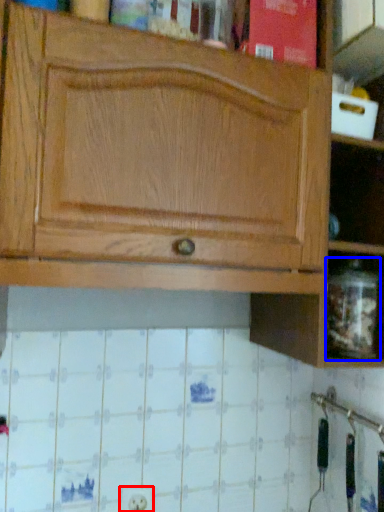
Question: Which of the following is the farthest to the observer, electric outlet (highlighted by a red box) or glass jar (highlighted by a blue box)?

Choices:
 (A) electric outlet
 (B) glass jar

Answer: (A)